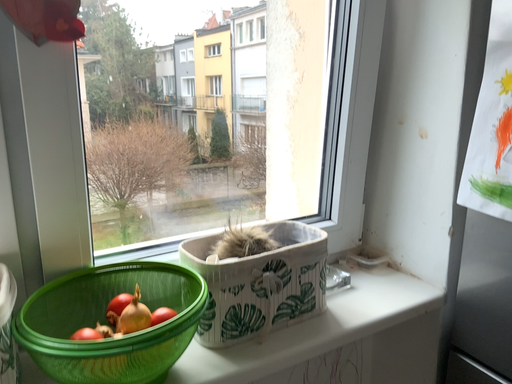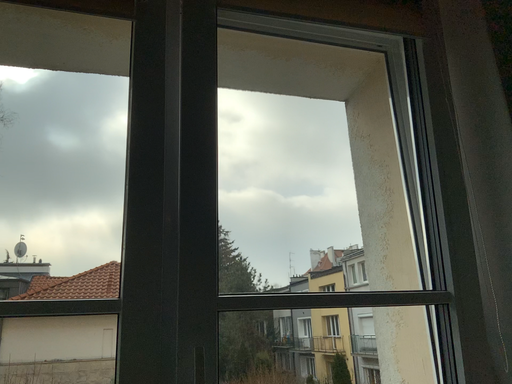
Question: How did the camera likely rotate when shooting the video?

Choices:
 (A) rotated left
 (B) rotated right

Answer: (A)